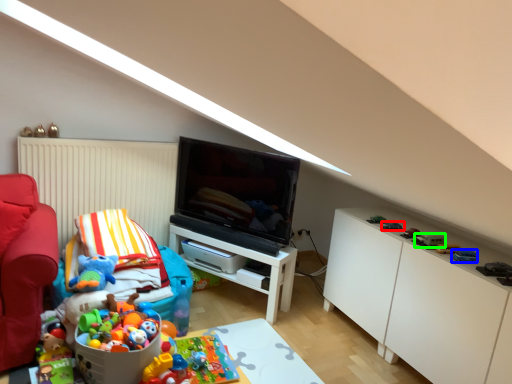
Question: Which object is the closest to the toy (highlighted by a red box)? Choose among these: toy (highlighted by a blue box) or toy (highlighted by a green box).

Choices:
 (A) toy
 (B) toy

Answer: (B)